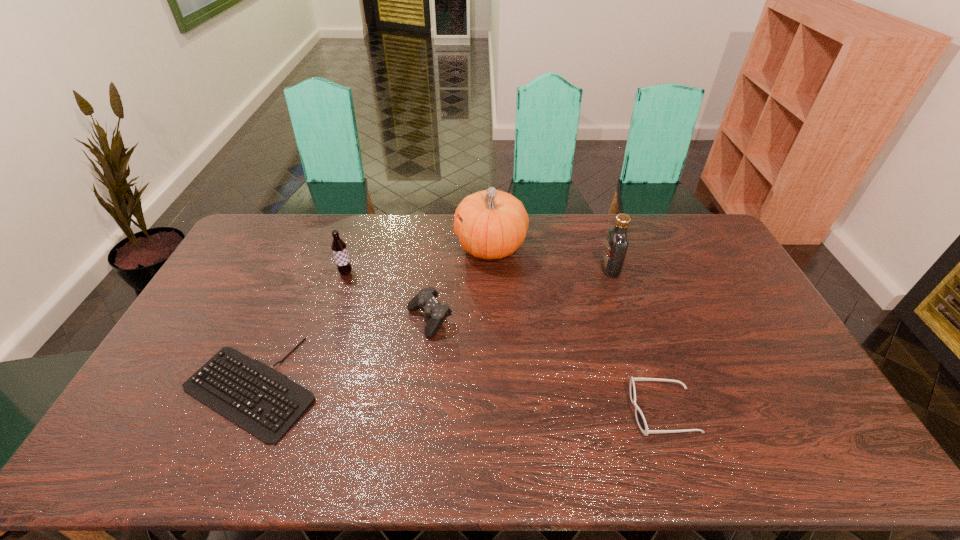
At what (x,y) coordinates should I click in order to perform the action: click on free space between the root beer and the control. Please return your answer as a coordinate pair (x, y). The height and width of the screenshot is (540, 960). Looking at the image, I should click on coord(388,296).

The height and width of the screenshot is (540, 960). In order to click on free space between the fourth tallest object and the vodka in this screenshot , I will do `click(520, 294)`.

Where is `vacant point located between the control and the pumpkin`? This screenshot has width=960, height=540. vacant point located between the control and the pumpkin is located at coordinates (460, 284).

The width and height of the screenshot is (960, 540). Find the location of `free space between the fourth tallest object and the root beer`. free space between the fourth tallest object and the root beer is located at coordinates (388, 296).

The width and height of the screenshot is (960, 540). What are the coordinates of `vacant area that lies between the shortest object and the second shortest object` in the screenshot? It's located at (457, 399).

You are a GUI agent. You are given a task and a screenshot of the screen. Output one action in this format:
    pyautogui.click(x=<x>, y=<y>)
    Task: Click on the vacant area between the shortest object and the third tallest object
    
    Given the screenshot: What is the action you would take?
    pyautogui.click(x=299, y=329)

Identify the location of free space between the third tallest object and the computer keyboard. coord(299,329).

Locate an element on the screen. This screenshot has height=540, width=960. free space between the fourth shortest object and the pumpkin is located at coordinates (419, 260).

Locate which object ranks second in proximity to the sunglasses. Please provide its 2D coordinates. Your answer should be formatted as a tuple, i.e. [(x, y)], where the tuple contains the x and y coordinates of a point satisfying the conditions above.

[(425, 300)]

Point out which object is positioned as the fifth nearest to the control. Please provide its 2D coordinates. Your answer should be formatted as a tuple, i.e. [(x, y)], where the tuple contains the x and y coordinates of a point satisfying the conditions above.

[(617, 242)]